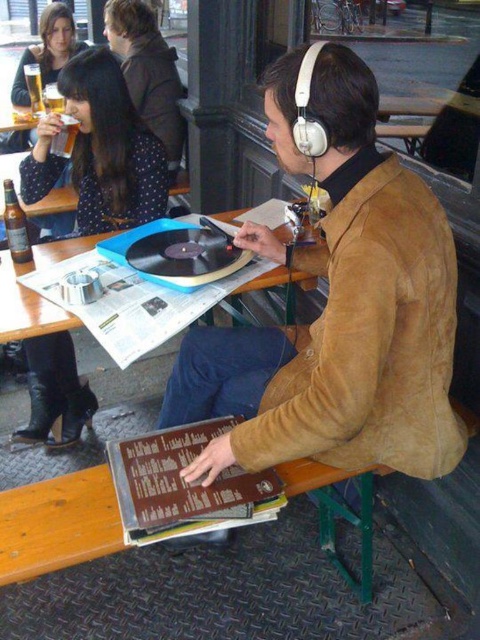
Question: Is blue plastic record player at center below translucent glass beer at upper left?

Choices:
 (A) yes
 (B) no

Answer: (A)

Question: Can you confirm if matte black dress at upper left is positioned above blue plastic record player at center?

Choices:
 (A) no
 (B) yes

Answer: (B)

Question: Does brown suede jacket at upper center appear on the left side of blue plastic record player at center?

Choices:
 (A) no
 (B) yes

Answer: (A)

Question: Among these objects, which one is nearest to the camera?

Choices:
 (A) translucent glass beer at upper left
 (B) blue plastic record player at center
 (C) brown glass bottle at left

Answer: (B)

Question: Which object is positioned farthest from the brown glass bottle at left?

Choices:
 (A) matte black dress at upper left
 (B) brown suede jacket at upper center
 (C) translucent glass beer at upper left

Answer: (C)

Question: Estimate the real-world distances between objects in this image. Which object is farther from the brown glass bottle at left?

Choices:
 (A) brown suede jacket at upper center
 (B) translucent glass beer at upper left

Answer: (B)